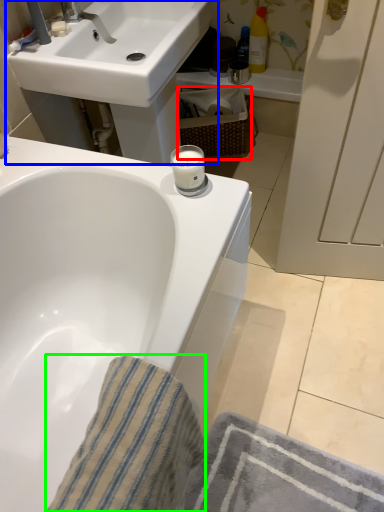
Question: Which is farther away from basket (highlighted by a red box)? sink (highlighted by a blue box) or bath towel (highlighted by a green box)?

Choices:
 (A) sink
 (B) bath towel

Answer: (B)